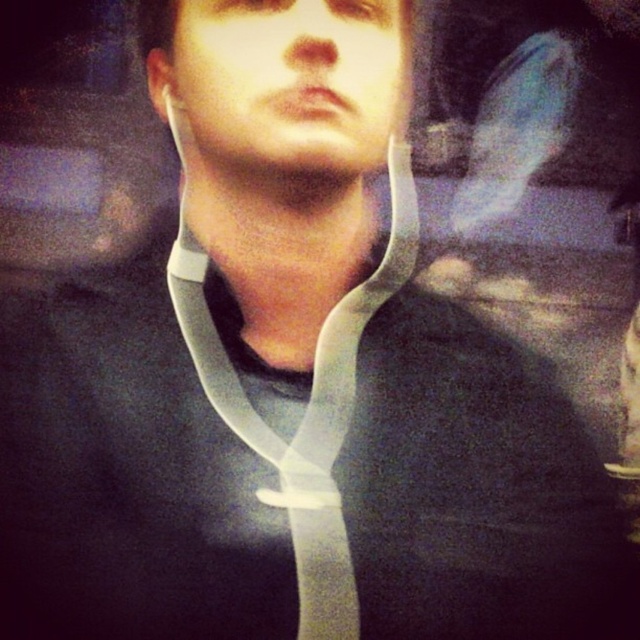
Question: Considering the relative positions of matte plastic neck brace at center and clear plastic neckband at center in the image provided, where is matte plastic neck brace at center located with respect to clear plastic neckband at center?

Choices:
 (A) right
 (B) left

Answer: (B)

Question: Is matte plastic neck brace at center closer to camera compared to clear plastic neckband at center?

Choices:
 (A) yes
 (B) no

Answer: (A)

Question: Can you confirm if matte plastic neck brace at center is wider than clear plastic neckband at center?

Choices:
 (A) no
 (B) yes

Answer: (A)

Question: Which point is closer to the camera taking this photo?

Choices:
 (A) (216, 406)
 (B) (346, 20)

Answer: (B)

Question: Which point is farther to the camera?

Choices:
 (A) (403, 246)
 (B) (336, 44)

Answer: (A)